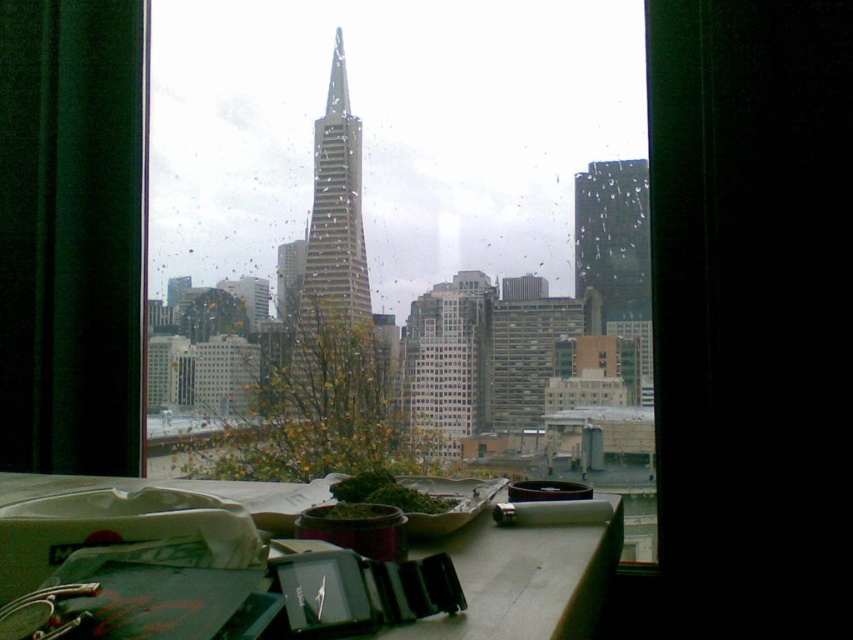
In the scene shown: Does glassy steel skyscraper at center have a greater width compared to glassy reflective skyscraper at right?

Indeed, glassy steel skyscraper at center has a greater width compared to glassy reflective skyscraper at right.

Which is more to the left, glassy steel skyscraper at center or glassy reflective skyscraper at right?

glassy steel skyscraper at center is more to the left.

Between point (335, 272) and point (584, 216), which one is positioned behind?

Point (335, 272)

Find the location of a particular element. glassy steel skyscraper at center is located at coordinates (335, 268).

Describe the element at coordinates (401, 150) in the screenshot. The width and height of the screenshot is (853, 640). I see `transparent glass window at center` at that location.

Is transparent glass window at center thinner than glassy steel skyscraper at center?

In fact, transparent glass window at center might be wider than glassy steel skyscraper at center.

Is point (489, 108) farther from camera compared to point (341, 339)?

That is True.

The image size is (853, 640). What are the coordinates of `transparent glass window at center` in the screenshot? It's located at (401, 150).

Does transparent glass window at center come behind glassy reflective skyscraper at right?

No, transparent glass window at center is closer to the viewer.

This screenshot has height=640, width=853. Describe the element at coordinates (401, 150) in the screenshot. I see `transparent glass window at center` at that location.

Locate an element on the screen. The width and height of the screenshot is (853, 640). transparent glass window at center is located at coordinates (401, 150).